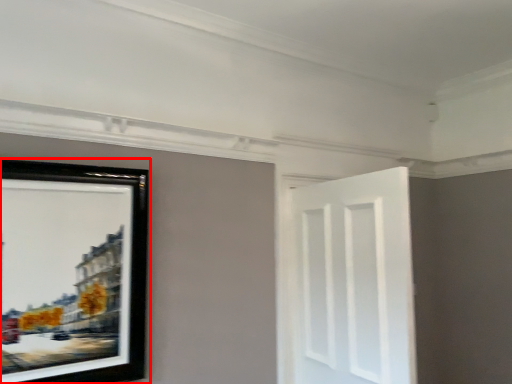
Question: From the image's perspective, what is the correct spatial relationship of picture frame (annotated by the red box) in relation to door?

Choices:
 (A) above
 (B) below

Answer: (A)